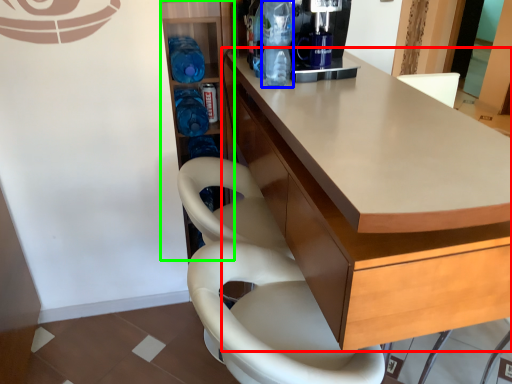
Question: Which object is the closest to the cabinetry (highlighted by a red box)? Choose among these: bottle (highlighted by a blue box) or shelf (highlighted by a green box).

Choices:
 (A) bottle
 (B) shelf

Answer: (A)